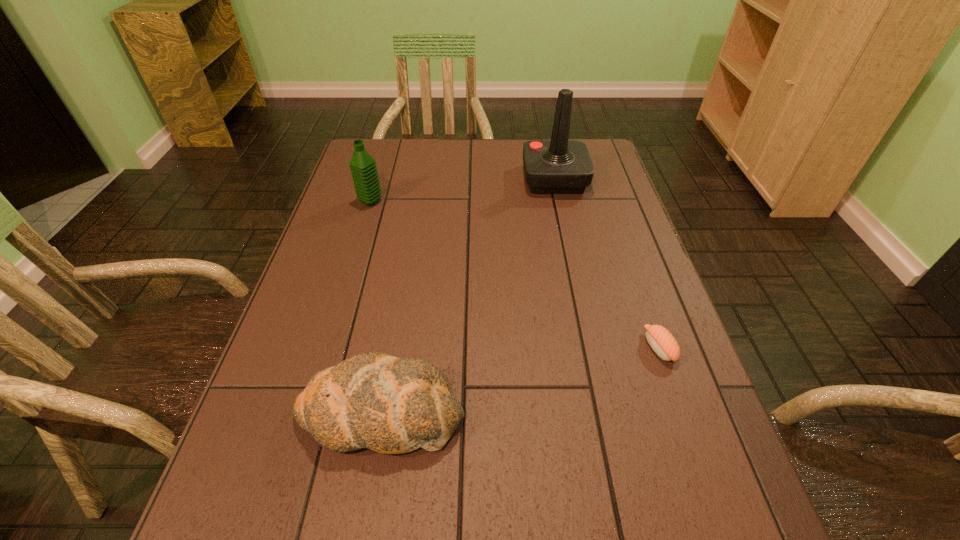
Locate an element on the screen. The width and height of the screenshot is (960, 540). blank area at the near right corner is located at coordinates (673, 537).

Locate an element on the screen. Image resolution: width=960 pixels, height=540 pixels. free spot between the joystick and the second tallest object is located at coordinates (463, 191).

You are a GUI agent. You are given a task and a screenshot of the screen. Output one action in this format:
    pyautogui.click(x=<x>, y=<y>)
    Task: Click on the vacant space that is in between the bread and the third shortest object
    The height and width of the screenshot is (540, 960).
    Given the screenshot: What is the action you would take?
    pyautogui.click(x=376, y=307)

Where is `empty location between the sushi and the joystick`? The height and width of the screenshot is (540, 960). empty location between the sushi and the joystick is located at coordinates (607, 264).

In order to click on vacant region between the second shortest object and the joystick in this screenshot , I will do `click(468, 296)`.

This screenshot has height=540, width=960. In order to click on free spot between the joystick and the water bottle in this screenshot , I will do `click(463, 191)`.

Find the location of a particular element. The height and width of the screenshot is (540, 960). free space between the sushi and the bread is located at coordinates (520, 380).

The width and height of the screenshot is (960, 540). Find the location of `free spot between the nearest object and the tallest object`. free spot between the nearest object and the tallest object is located at coordinates (468, 296).

You are a GUI agent. You are given a task and a screenshot of the screen. Output one action in this format:
    pyautogui.click(x=<x>, y=<y>)
    Task: Click on the unoccupied area between the shortest object and the nearest object
    
    Given the screenshot: What is the action you would take?
    pyautogui.click(x=520, y=380)

Where is `free space between the tallest object and the third shortest object`? The image size is (960, 540). free space between the tallest object and the third shortest object is located at coordinates (463, 191).